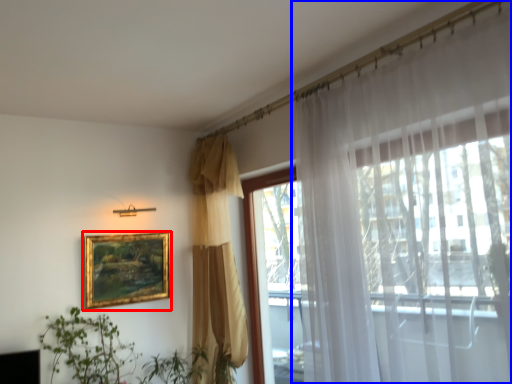
Question: Which object appears closest to the camera in this image, picture frame (highlighted by a red box) or curtain (highlighted by a blue box)?

Choices:
 (A) picture frame
 (B) curtain

Answer: (B)